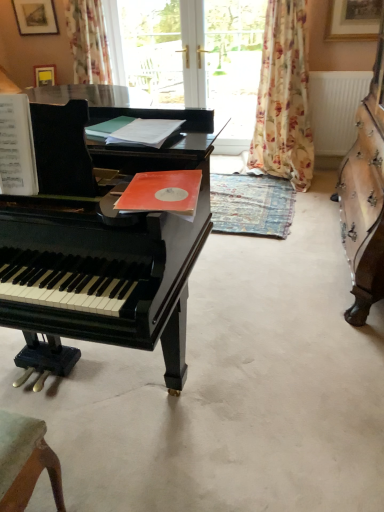
Question: Considering the positions of point (367, 120) and point (286, 96), is point (367, 120) closer or farther from the camera than point (286, 96)?

Choices:
 (A) closer
 (B) farther

Answer: (A)

Question: Looking at their shapes, would you say matte black harpsichord at center is wider or thinner than floral fabric curtain at center, which ranks as the 2th curtain in left-to-right order?

Choices:
 (A) thin
 (B) wide

Answer: (A)

Question: Estimate the real-world distances between objects in this image. Which object is closer to the glossy black piano at left?

Choices:
 (A) floral fabric curtain at upper left, positioned as the second curtain in right-to-left order
 (B) floral fabric curtain at center, which is the 1th curtain in right-to-left order
 (C) black piano at left
 (D) transparent glass door at upper center, the second window screen when ordered from right to left
 (E) white plastic radiator at upper right

Answer: (C)

Question: Estimate the real-world distances between objects in this image. Which object is closer to the matte black harpsichord at center?

Choices:
 (A) floral fabric curtain at center, which is the 1th curtain in right-to-left order
 (B) floral fabric curtain at upper left, which ranks as the 1th curtain in left-to-right order
 (C) transparent glass door at center, marked as the 2th window screen in a left-to-right arrangement
 (D) black piano at left
 (E) glossy black piano at left

Answer: (D)